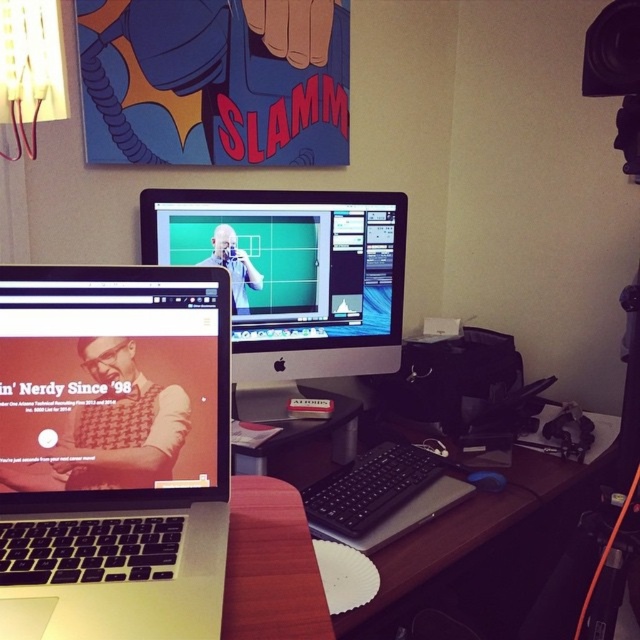
Is satin black monitor at center positioned in front of black plastic computer desk at center?

No, satin black monitor at center is behind black plastic computer desk at center.

Is point (280, 282) more distant than point (285, 433)?

Yes, point (280, 282) is farther from viewer.

The image size is (640, 640). I want to click on satin black monitor at center, so click(x=292, y=273).

Does silver metallic laptop at lower left have a lesser height compared to black plastic computer desk at center?

Yes.

What are the coordinates of `silver metallic laptop at lower left` in the screenshot? It's located at (115, 448).

Identify the location of silver metallic laptop at lower left. This screenshot has width=640, height=640. (115, 448).

Is silver metallic laptop at lower left to the right of satin black monitor at center from the viewer's perspective?

In fact, silver metallic laptop at lower left is to the left of satin black monitor at center.

Image resolution: width=640 pixels, height=640 pixels. Find the location of `silver metallic laptop at lower left`. silver metallic laptop at lower left is located at coordinates (115, 448).

The height and width of the screenshot is (640, 640). Identify the location of silver metallic laptop at lower left. [x=115, y=448].